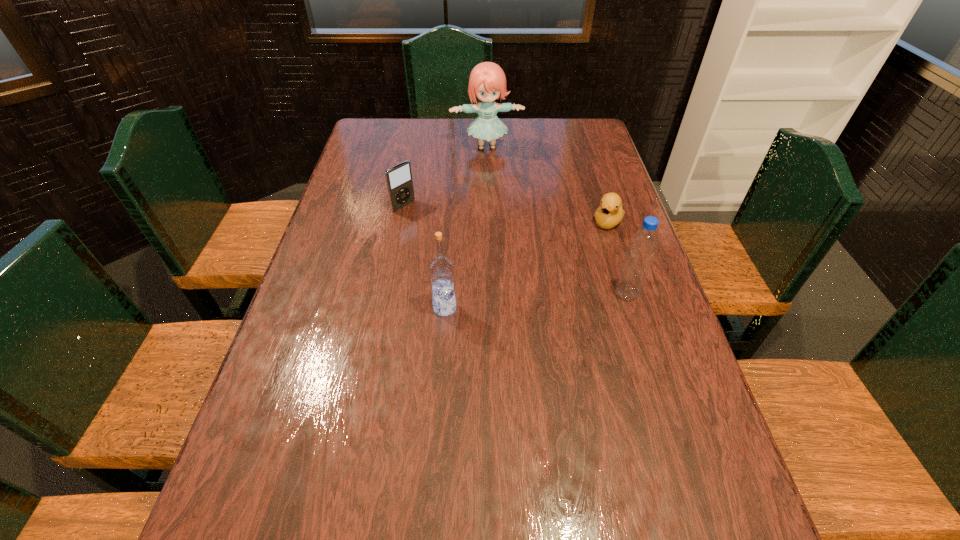
This screenshot has height=540, width=960. I want to click on free space on the desktop that is between the vodka and the water bottle and is positioned on the front-facing side of the farthest object, so click(514, 302).

The image size is (960, 540). I want to click on vacant spot on the desktop that is between the vodka and the water bottle and is positioned on the face of the duckling, so click(x=555, y=299).

This screenshot has width=960, height=540. Identify the location of vacant space on the desktop that is between the vodka and the water bottle and is positioned on the front-facing side of the second shortest object. (542, 300).